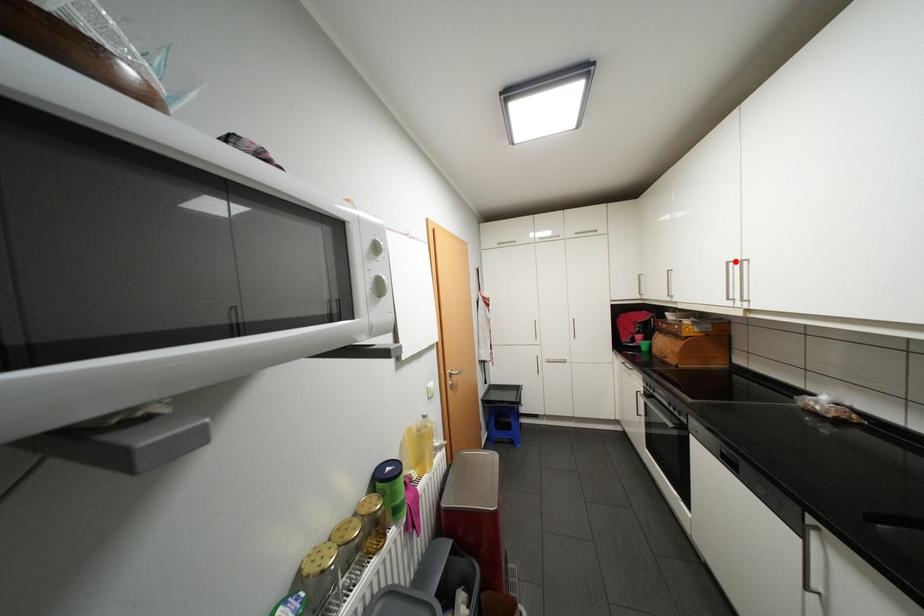
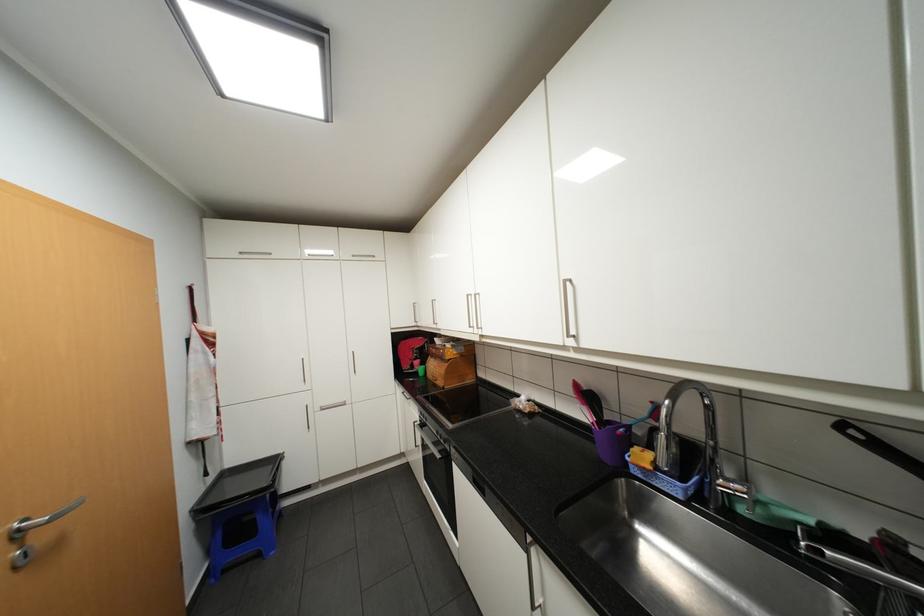
Locate, in the second image, the point that corresponds to the highlighted location in the first image.

(476, 294)